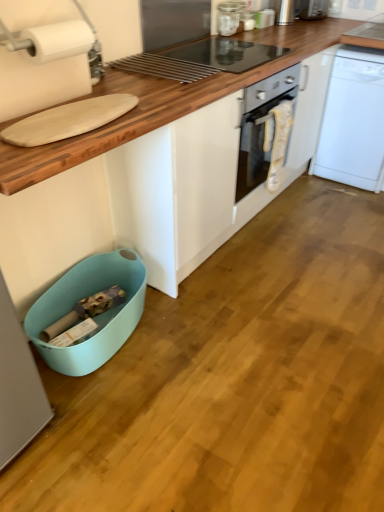
Image resolution: width=384 pixels, height=512 pixels. I want to click on free point to the right of metallic silver toaster at upper right, which is counted as the 2th appliance, starting from the right, so click(x=311, y=25).